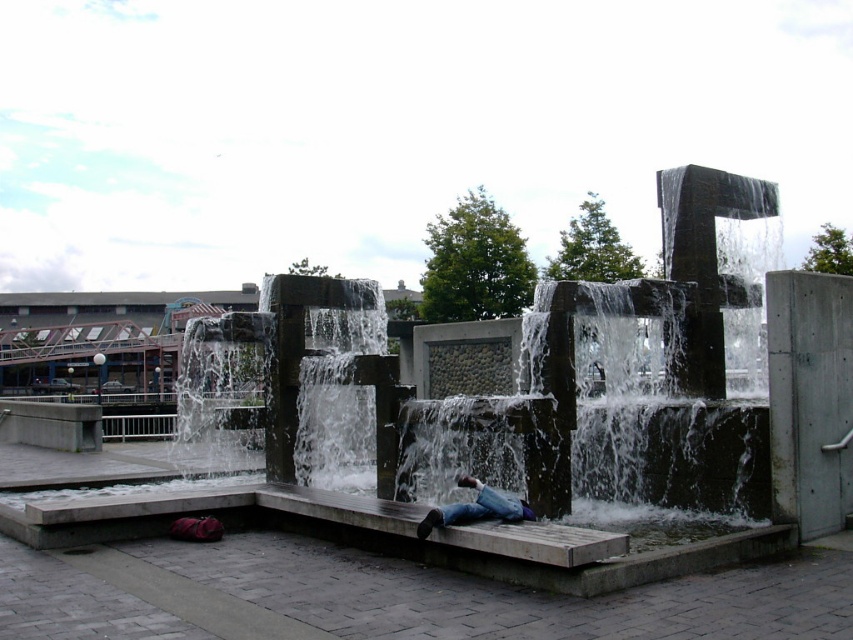
Is concrete water at center to the right of blue jeans at center from the viewer's perspective?

Incorrect, concrete water at center is not on the right side of blue jeans at center.

Image resolution: width=853 pixels, height=640 pixels. What do you see at coordinates (376, 474) in the screenshot?
I see `concrete water at center` at bounding box center [376, 474].

The height and width of the screenshot is (640, 853). I want to click on concrete water at center, so click(x=376, y=474).